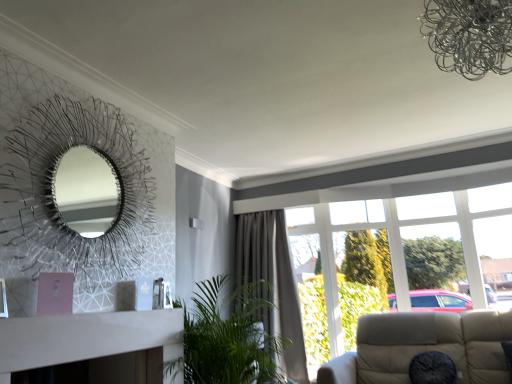
Question: Based on their positions, is metallic silver fireplace at left located to the left or right of green leafy plant at center?

Choices:
 (A) left
 (B) right

Answer: (A)

Question: Is metallic silver fireplace at left inside or outside of green leafy plant at center?

Choices:
 (A) outside
 (B) inside

Answer: (A)

Question: Which is nearer to the transparent glass window at right?

Choices:
 (A) gray fabric curtain at center
 (B) black fabric cushion at lower right
 (C) metallic silver fireplace at left
 (D) green leafy plant at center

Answer: (A)

Question: Which object is positioned closest to the green leafy plant at center?

Choices:
 (A) gray fabric curtain at center
 (B) black fabric cushion at lower right
 (C) metallic silver fireplace at left
 (D) transparent glass window at right

Answer: (C)